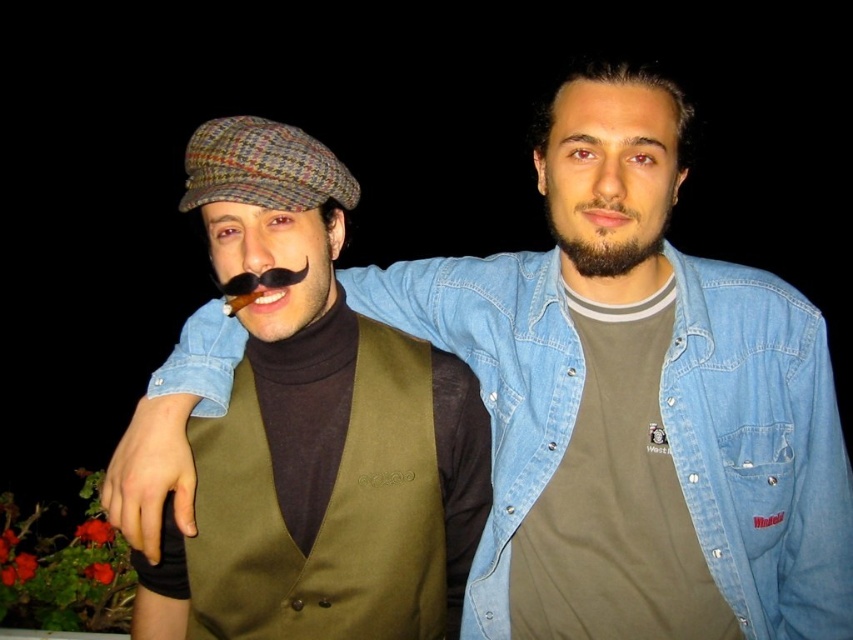
Between faded denim jacket at upper center and dark brown stubble at center, which one is positioned higher?

Positioned higher is dark brown stubble at center.

Can you confirm if faded denim jacket at upper center is positioned above dark brown stubble at center?

No, faded denim jacket at upper center is not above dark brown stubble at center.

Is point (778, 282) farther from camera compared to point (585, 237)?

Yes.

I want to click on faded denim jacket at upper center, so click(x=759, y=449).

Between matte brown cap at center and faded denim jacket at upper center, which one has less height?

Standing shorter between the two is faded denim jacket at upper center.

Is point (323, 360) farther from camera compared to point (662, 372)?

Yes, point (323, 360) is behind point (662, 372).

What are the coordinates of `matte brown cap at center` in the screenshot? It's located at (314, 429).

Who is lower down, matte brown cap at center or dark brown stubble at center?

matte brown cap at center is lower down.

Between matte brown cap at center and dark brown stubble at center, which one is positioned higher?

dark brown stubble at center is above.

Between point (410, 509) and point (601, 236), which one is positioned behind?

The point (410, 509) is behind.

Image resolution: width=853 pixels, height=640 pixels. What are the coordinates of `matte brown cap at center` in the screenshot? It's located at (314, 429).